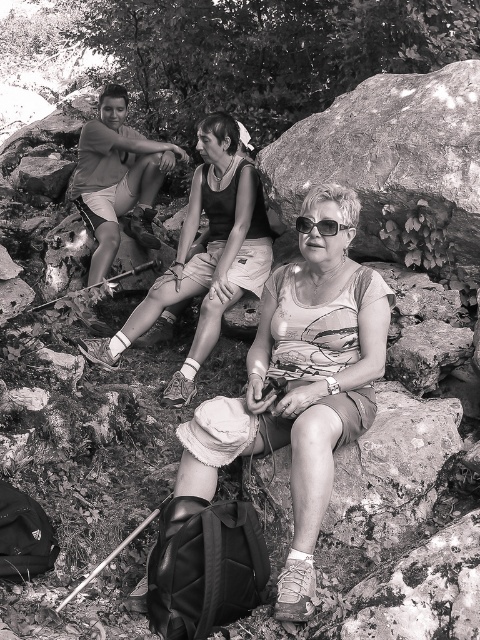
Is matte black tank top at center thinner than matte shorts at left?

Incorrect, matte black tank top at center's width is not less than matte shorts at left's.

Can you confirm if matte black tank top at center is positioned above matte shorts at left?

Incorrect, matte black tank top at center is not positioned above matte shorts at left.

Who is more forward, (131, 342) or (111, 172)?

Positioned in front is point (131, 342).

This screenshot has height=640, width=480. In order to click on matte black tank top at center in this screenshot , I will do `click(205, 256)`.

Looking at this image, is matte fabric hat at center above matte black tank top at center?

No.

Is point (324, 483) closer to viewer compared to point (230, 216)?

Yes.

Does point (326, 428) come farther from viewer compared to point (249, 198)?

No, (326, 428) is closer to viewer.

Where is `matte fabric hat at center`? Image resolution: width=480 pixels, height=640 pixels. matte fabric hat at center is located at coordinates (300, 384).

Is rough textured rock at center to the left of matte black tank top at center from the viewer's perspective?

No, rough textured rock at center is not to the left of matte black tank top at center.

Is rough textured rock at center to the right of matte black tank top at center from the viewer's perspective?

Indeed, rough textured rock at center is positioned on the right side of matte black tank top at center.

Measure the distance between point (320, 140) and camera.

Point (320, 140) and camera are 3.79 meters apart from each other.

The width and height of the screenshot is (480, 640). I want to click on rough textured rock at center, so click(x=392, y=156).